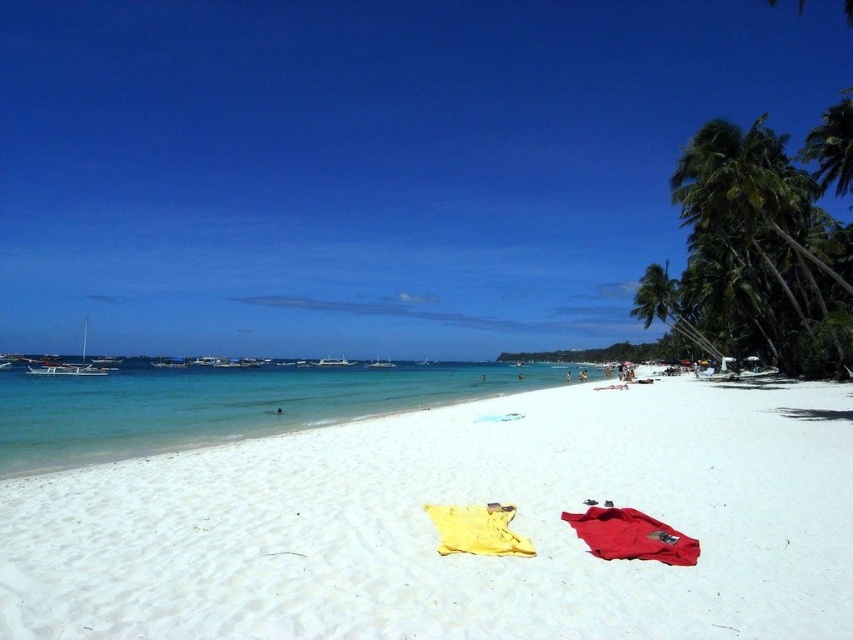
Question: Which object is the farthest from the matte red towel at lower right?

Choices:
 (A) clear blue water at center
 (B) green leafy palm tree at right
 (C) white sandy beach at center

Answer: (A)

Question: Can you confirm if green leafy palm tree at right is positioned to the right of matte red towel at lower right?

Choices:
 (A) yes
 (B) no

Answer: (A)

Question: Which object is the closest to the clear blue water at center?

Choices:
 (A) matte red towel at lower right
 (B) green leafy palm tree at right
 (C) white sandy beach at center

Answer: (C)

Question: Estimate the real-world distances between objects in this image. Which object is closer to the green leafy palm tree at right?

Choices:
 (A) white sandy beach at center
 (B) clear blue water at center

Answer: (A)

Question: Can you confirm if white sandy beach at center is positioned to the right of clear blue water at center?

Choices:
 (A) yes
 (B) no

Answer: (A)

Question: Considering the relative positions of white sandy beach at center and clear blue water at center in the image provided, where is white sandy beach at center located with respect to clear blue water at center?

Choices:
 (A) above
 (B) below

Answer: (A)